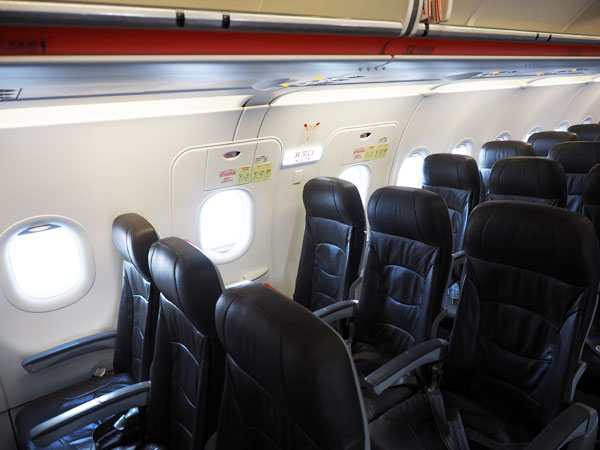
The image size is (600, 450). I want to click on seat arms, so click(82, 345), click(91, 403), click(325, 315), click(411, 362), click(457, 257), click(564, 427).